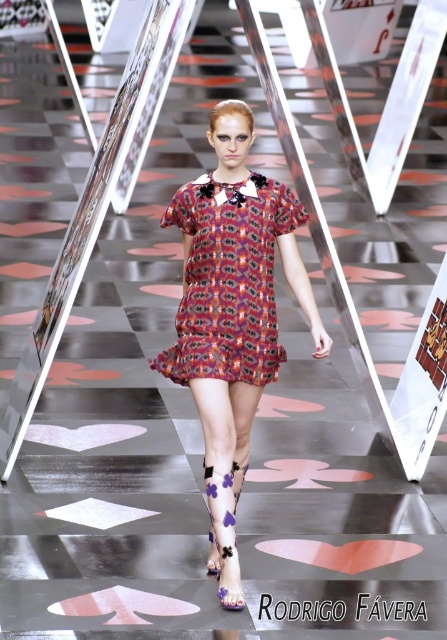
Is printed fabric dress at center closer to the viewer compared to printed silk dress at center?

That is True.

Does printed fabric dress at center have a greater height compared to printed silk dress at center?

Yes.

Is point (215, 412) less distant than point (222, 305)?

That is True.

Locate an element on the screen. This screenshot has height=640, width=447. printed fabric dress at center is located at coordinates (231, 316).